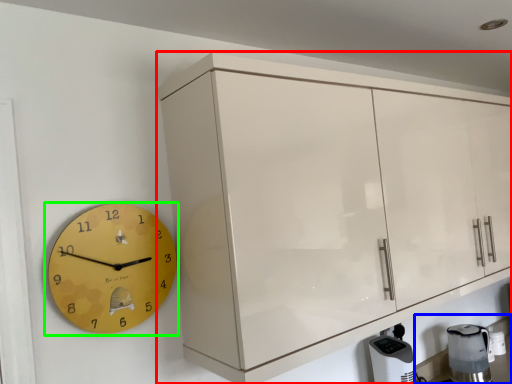
Question: Considering the real-world distances, which object is farthest from cabinetry (highlighted by a red box)? counter top (highlighted by a blue box) or wall clock (highlighted by a green box)?

Choices:
 (A) counter top
 (B) wall clock

Answer: (A)